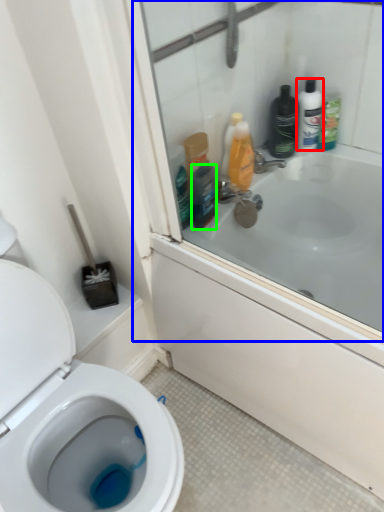
Question: Which is nearer to the toiletry (highlighted by a red box)? screen door (highlighted by a blue box) or mouthwash (highlighted by a green box).

Choices:
 (A) screen door
 (B) mouthwash

Answer: (A)